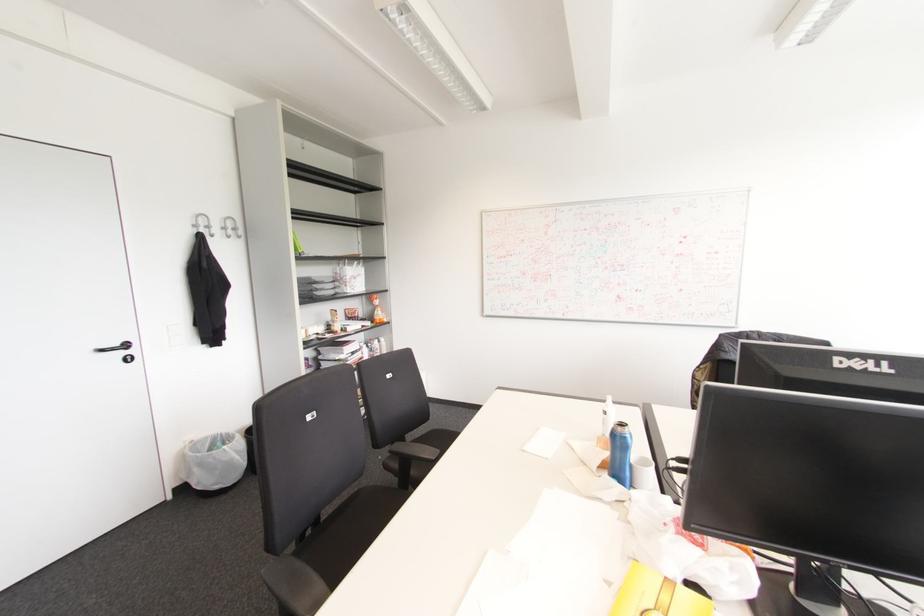
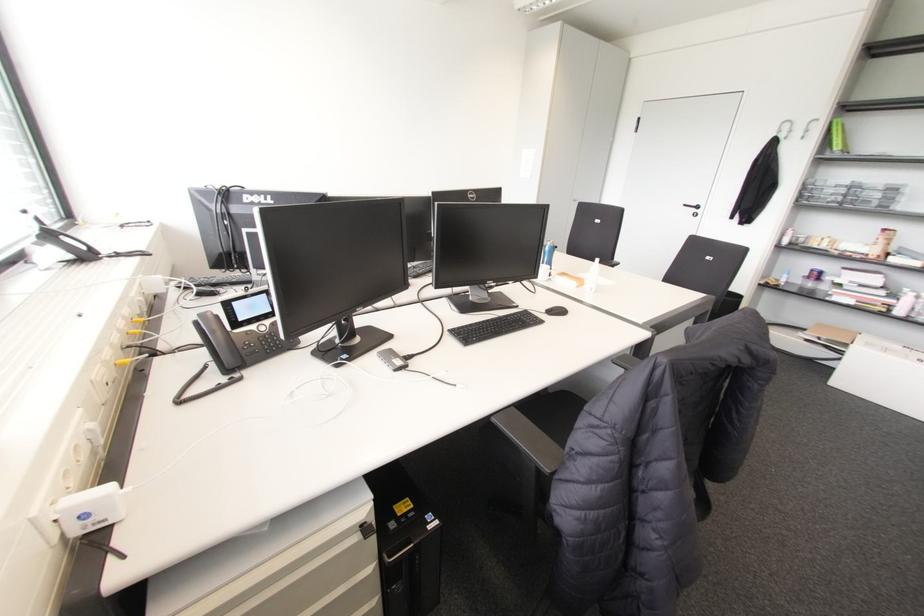
Find the pixel in the second image that matches point (126, 345) in the first image.

(697, 207)